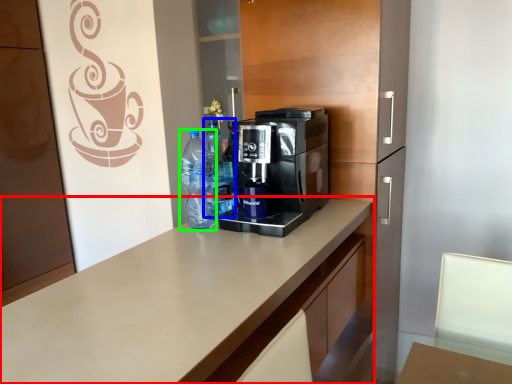
Question: Estimate the real-world distances between objects in this image. Which object is closer to countertop (highlighted by a red box), bottle (highlighted by a blue box) or bottle (highlighted by a green box)?

Choices:
 (A) bottle
 (B) bottle

Answer: (B)